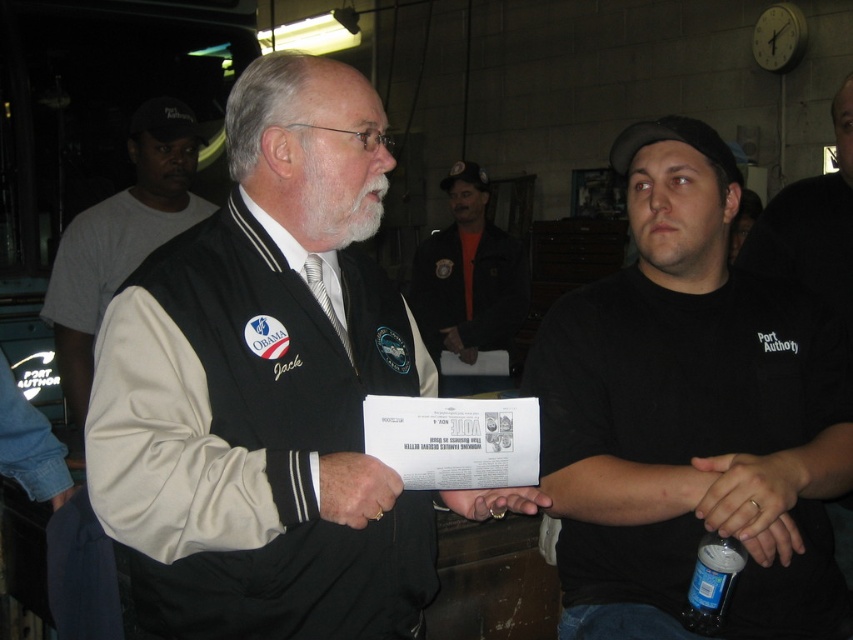
Question: Which of the following is the closest to the observer?

Choices:
 (A) orange shirt at center
 (B) matte black hand at center

Answer: (B)

Question: Among these objects, which one is farthest from the camera?

Choices:
 (A) black fabric jacket at center
 (B) matte black hand at center
 (C) clear plastic bottle at lower right

Answer: (C)

Question: Which point is farther to the camera?

Choices:
 (A) (312, 122)
 (B) (469, 497)
 (C) (437, 356)
 (D) (840, 100)

Answer: (C)

Question: Observing the image, what is the correct spatial positioning of clear plastic bottle at lower right in reference to matte black hand at center?

Choices:
 (A) right
 (B) left

Answer: (A)

Question: Is black fabric vest at center to the left of orange shirt at center from the viewer's perspective?

Choices:
 (A) no
 (B) yes

Answer: (B)

Question: Can you confirm if black fabric jacket at center is thinner than matte black hand at center?

Choices:
 (A) yes
 (B) no

Answer: (B)